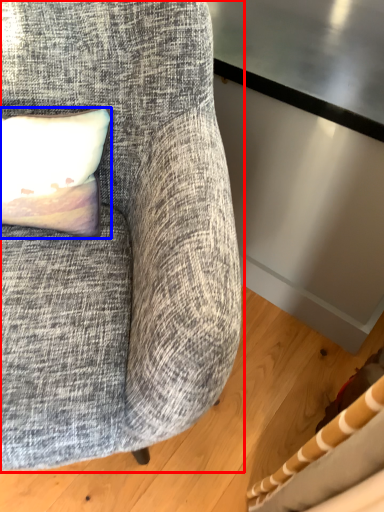
Question: Which object appears farthest to the camera in this image, chair (highlighted by a red box) or pillow (highlighted by a blue box)?

Choices:
 (A) chair
 (B) pillow

Answer: (B)